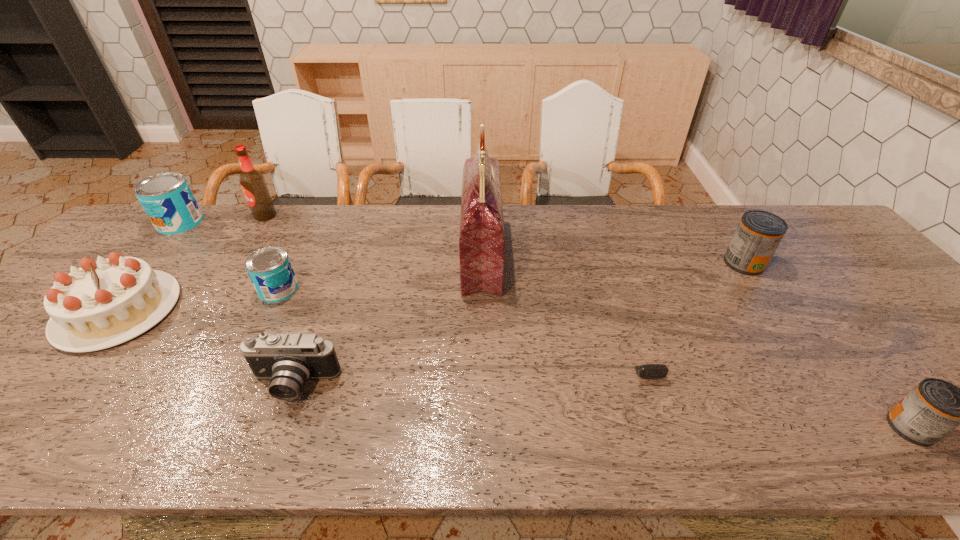
Locate an element on the screen. The width and height of the screenshot is (960, 540). empty space that is in between the birthday cake and the shortest object is located at coordinates (376, 329).

Image resolution: width=960 pixels, height=540 pixels. Identify the location of vacant space that's between the eighth shortest object and the handbag. click(x=373, y=236).

The image size is (960, 540). Find the location of `blank region between the leftmost can and the camera`. blank region between the leftmost can and the camera is located at coordinates (237, 304).

This screenshot has height=540, width=960. I want to click on free spot between the eighth shortest object and the farthest can, so click(x=223, y=219).

Where is `unoccupied area between the beer bottle and the farther blue can`? unoccupied area between the beer bottle and the farther blue can is located at coordinates (223, 219).

Locate which object ranks sixth in proximity to the birthday cake. Please provide its 2D coordinates. Your answer should be formatted as a tuple, i.e. [(x, y)], where the tuple contains the x and y coordinates of a point satisfying the conditions above.

[(648, 370)]

Find the location of a particular element. The image size is (960, 540). the third closest object to the second tallest object is located at coordinates (270, 270).

What are the coordinates of `can that is the second nearest to the smaller red can` in the screenshot? It's located at (270, 270).

Image resolution: width=960 pixels, height=540 pixels. In order to click on the third closest can to the farther red can in this screenshot , I will do [x=167, y=199].

Image resolution: width=960 pixels, height=540 pixels. I want to click on vacant region that satisfies the following two spatial constraints: 1. on the back side of the bigger red can; 2. on the front-facing side of the tallest object, so click(x=739, y=256).